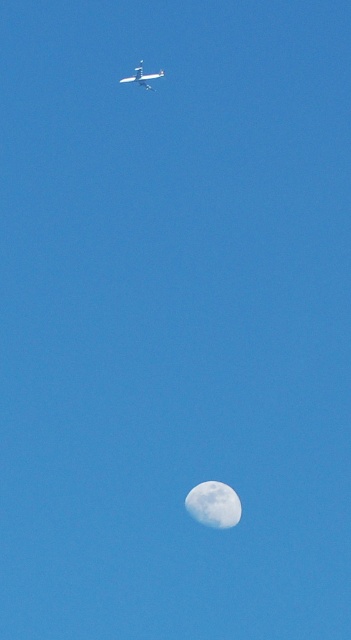
Question: From the image, what is the correct spatial relationship of white textured moon at lower center in relation to metallic silver airplane at upper center?

Choices:
 (A) below
 (B) above

Answer: (A)

Question: Is white textured moon at lower center to the left of metallic silver airplane at upper center from the viewer's perspective?

Choices:
 (A) yes
 (B) no

Answer: (B)

Question: Which of the following is the farthest from the observer?

Choices:
 (A) metallic silver airplane at upper center
 (B) white textured moon at lower center

Answer: (B)

Question: Does white textured moon at lower center have a larger size compared to metallic silver airplane at upper center?

Choices:
 (A) no
 (B) yes

Answer: (B)

Question: Which point is farther to the camera?

Choices:
 (A) metallic silver airplane at upper center
 (B) white textured moon at lower center

Answer: (B)